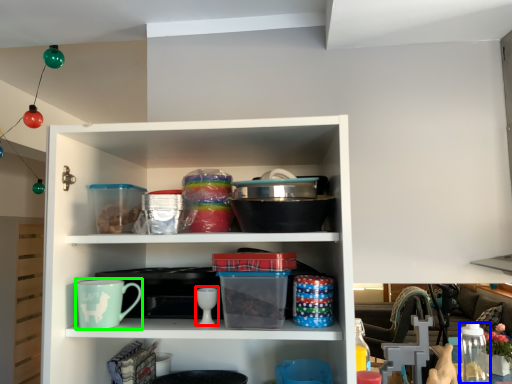
Question: Which object is positioned closest to tableware (highlighted by a red box)? Select from glass jar (highlighted by a blue box) and mug (highlighted by a green box).

Choices:
 (A) glass jar
 (B) mug

Answer: (B)